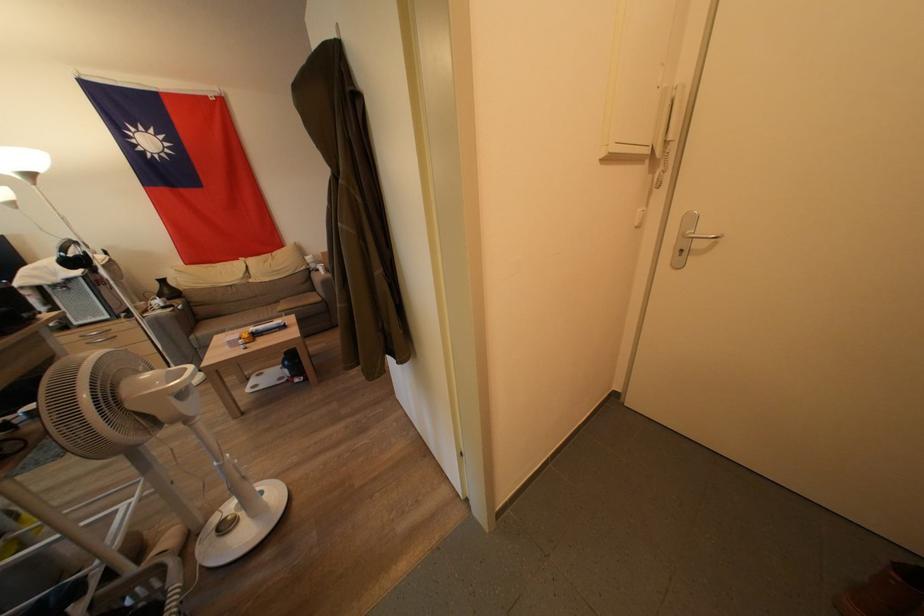
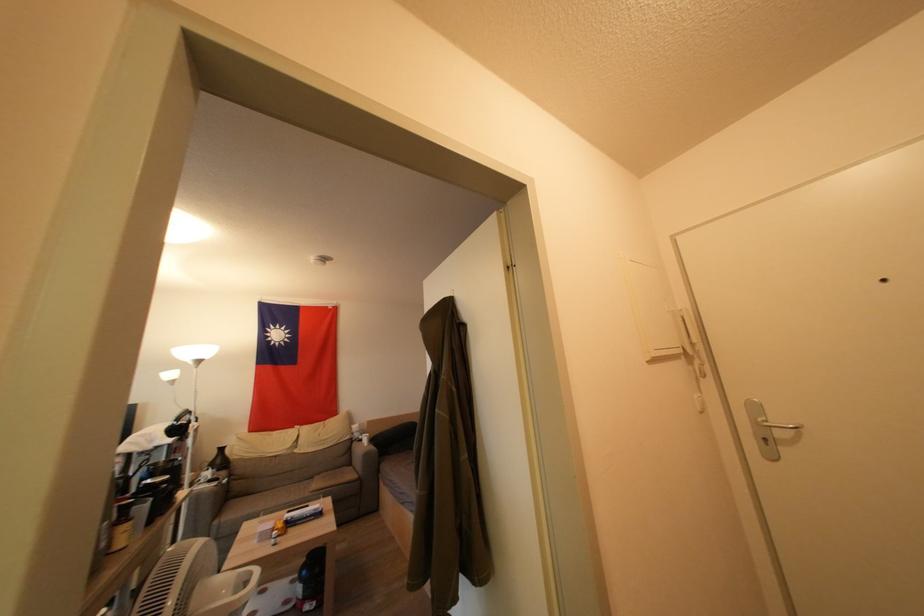
The point at (190,373) is marked in the first image. Where is the corresponding point in the second image?

(256, 577)